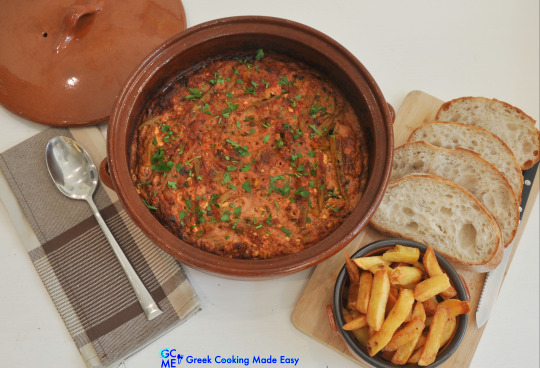
Where is `bowl`? bowl is located at coordinates (359, 350).